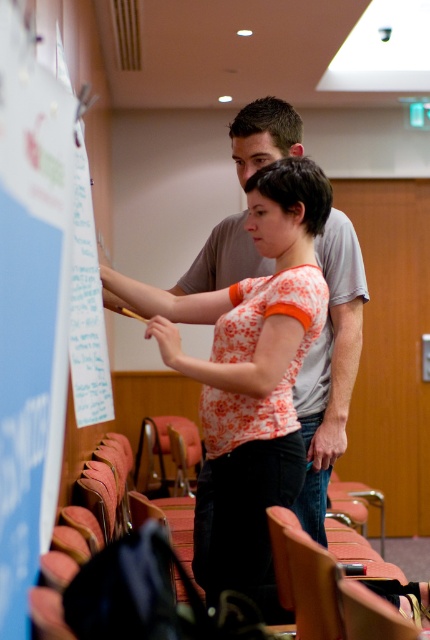
Is floral cotton shirt at center below white paper at left?

Indeed, floral cotton shirt at center is positioned under white paper at left.

Does point (258, 564) lie behind point (15, 232)?

Yes, point (258, 564) is farther from viewer.

Identify the location of floral cotton shirt at center. (248, 378).